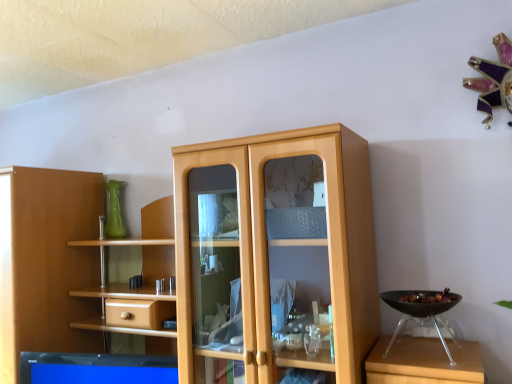
Question: From a real-world perspective, is black plastic bowl at right positioned above or below light wood cupboard at center?

Choices:
 (A) above
 (B) below

Answer: (B)

Question: Does point (407, 319) appear closer or farther from the camera than point (271, 221)?

Choices:
 (A) closer
 (B) farther

Answer: (B)

Question: Based on their relative distances, which object is nearer to the green glass vase at upper left?

Choices:
 (A) black plastic bowl at right
 (B) light wood cupboard at center

Answer: (B)

Question: Which object is positioned closest to the green glass vase at upper left?

Choices:
 (A) light wood cupboard at center
 (B) black plastic bowl at right

Answer: (A)